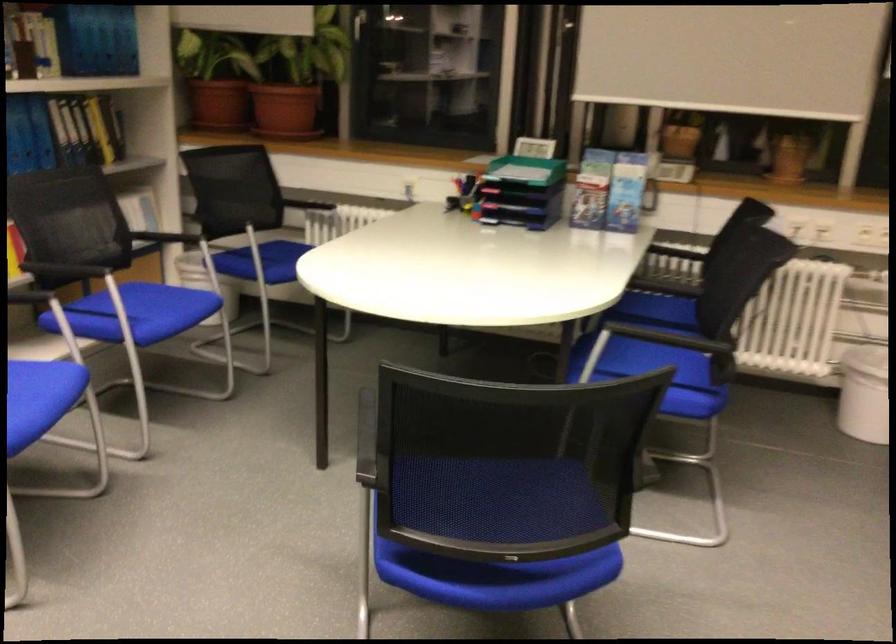
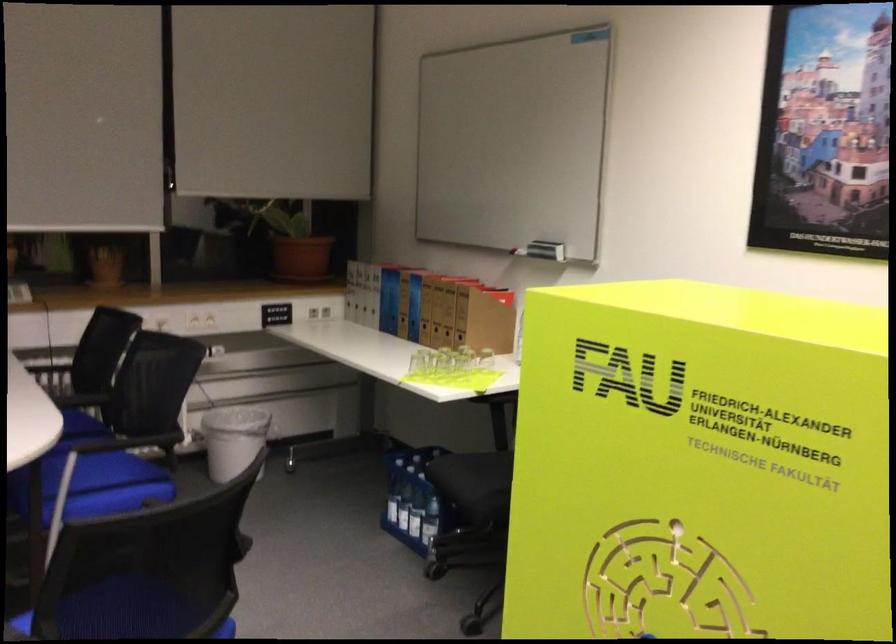
Locate, in the second image, the point that corresponds to point 691,310 in the first image.

(81, 424)